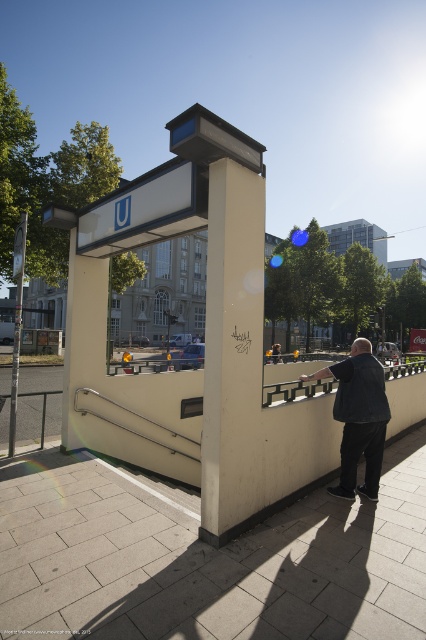
From the picture: You are a delivery person who needs to park your 2.5 meter long bike. You see the gray concrete pavement at lower center and the beige concrete bus stop at center. Which area is large enough to park your bike without blocking the entrance?

The beige concrete bus stop at center has a larger size compared to the gray concrete pavement at lower center, so it is more likely to accommodate the 2.5 meter long bike without blocking the entrance.

Consider the image. You are a delivery person trying to park your 1.2 meter wide electric scooter. You see the gray concrete pavement at lower center and the beige concrete bus stop at center. Which location has enough space to park your scooter?

The gray concrete pavement at lower center has a larger width than the beige concrete bus stop at center, so it can accommodate the 1.2 meter wide electric scooter.

You are a pedestrian standing at the subway entrance and want to step onto the gray concrete pavement at lower center. Is the dark blue denim jacket at center blocking your path to the pavement?

The gray concrete pavement at lower center is closer to the viewer than the dark blue denim jacket at center, so the jacket is not blocking the path to the pavement.